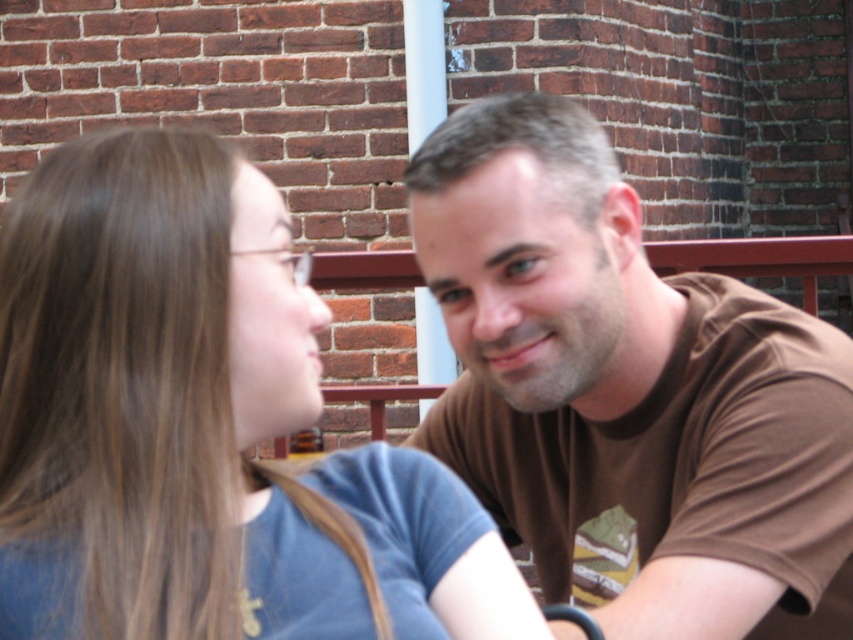
In the scene shown: You are standing at the point with coordinates point [111,246] and want to walk to the point with coordinates point [593,467]. Given the scene described, will the brick wall block your path?

Point [593,467] is behind point [111,246], so the brick wall would block your path to the point with coordinates point [593,467].